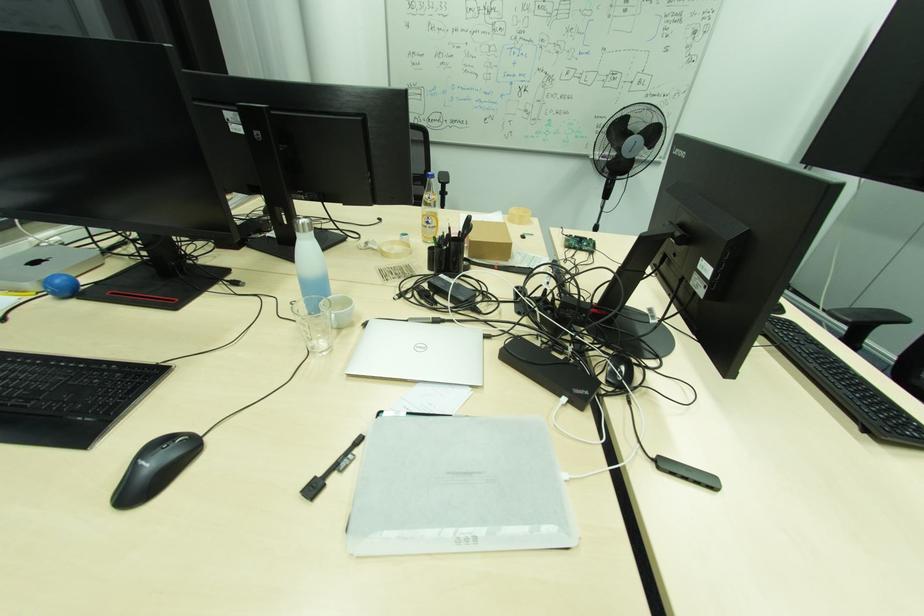
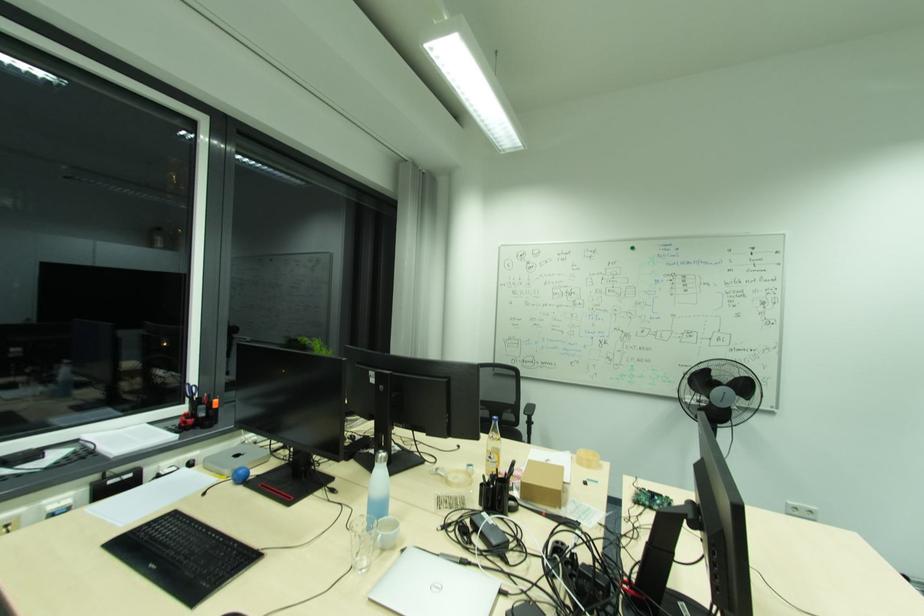
The point at (310, 232) is marked in the first image. Where is the corresponding point in the second image?

(385, 461)